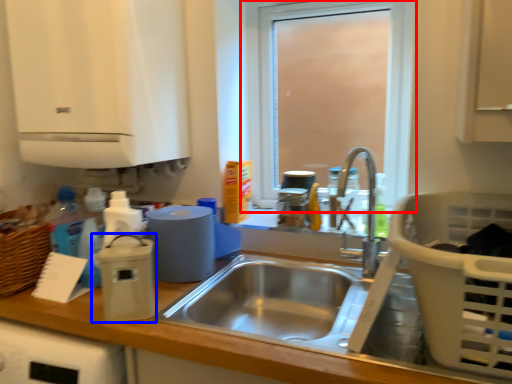
Question: Which point is closer to the camera, window (highlighted by a red box) or appliance (highlighted by a blue box)?

Choices:
 (A) window
 (B) appliance

Answer: (B)